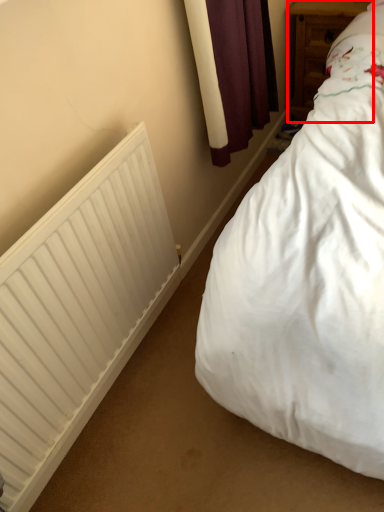
Question: From the image's perspective, where is furniture (annotated by the red box) located relative to radiator?

Choices:
 (A) above
 (B) below

Answer: (A)